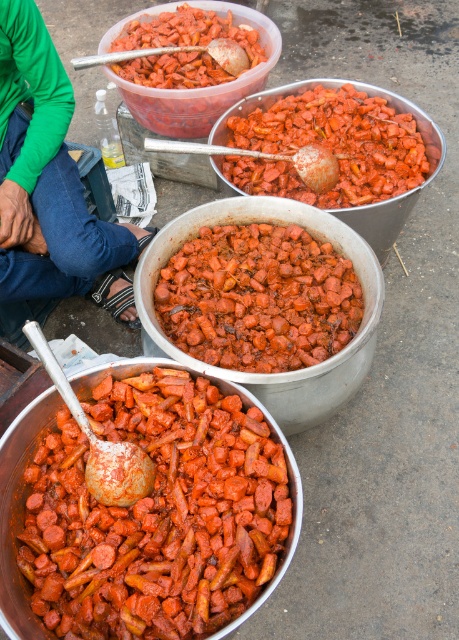
Is glossy red carrot at center positioned behind matte plastic carrots at center?

No, it is in front of matte plastic carrots at center.

Between glossy red carrot at center and matte plastic carrots at center, which one appears on the left side from the viewer's perspective?

From the viewer's perspective, glossy red carrot at center appears more on the left side.

Who is more distant from viewer, (212, 241) or (325, 104)?

Point (325, 104)

This screenshot has height=640, width=459. I want to click on glossy red carrot at center, so click(257, 298).

This screenshot has width=459, height=640. Identify the location of shiny red carrot at bottom left. (156, 513).

The height and width of the screenshot is (640, 459). What do you see at coordinates (156, 513) in the screenshot? I see `shiny red carrot at bottom left` at bounding box center [156, 513].

Does point (196, 611) come farther from viewer compared to point (298, 102)?

No, it is not.

Locate an element on the screen. This screenshot has height=640, width=459. shiny red carrot at bottom left is located at coordinates (156, 513).

Can you confirm if shiny red carrot at bottom left is positioned above glossy red carrot at center?

Incorrect, shiny red carrot at bottom left is not positioned above glossy red carrot at center.

Who is more distant from viewer, (167, 520) or (247, 326)?

The point (247, 326) is behind.

Does point (138, 634) come in front of point (196, 300)?

That is True.

Identify the location of shiny red carrot at bottom left. Image resolution: width=459 pixels, height=640 pixels. (156, 513).